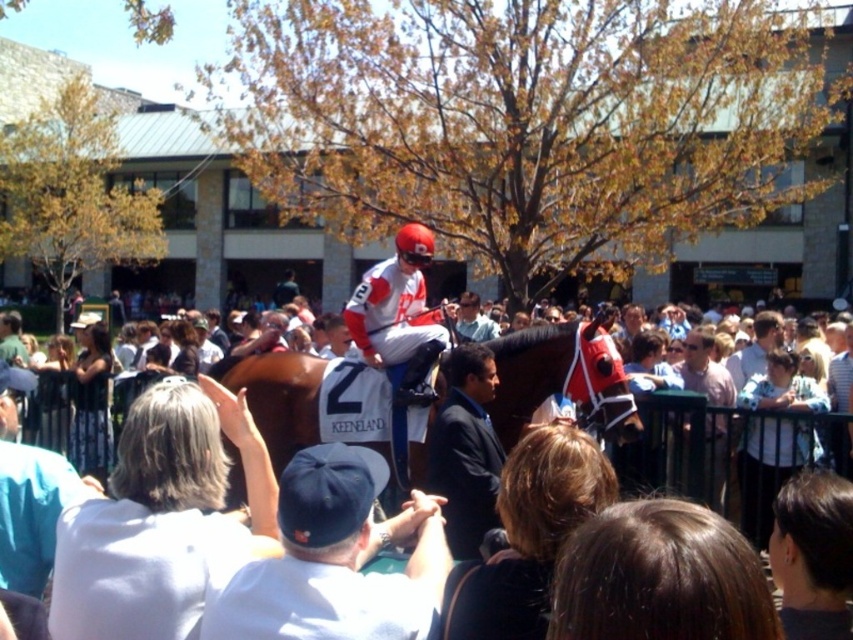
Question: Is matte red helmet at center wider than light blue shirt at center?

Choices:
 (A) yes
 (B) no

Answer: (A)

Question: Can you confirm if teal fabric shirt at lower left is positioned to the left of light pink shirt at center?

Choices:
 (A) no
 (B) yes

Answer: (B)

Question: Among these points, which one is farthest from the camera?

Choices:
 (A) (299, 364)
 (B) (1, 416)
 (C) (775, 336)
 (D) (490, 317)

Answer: (D)

Question: Does white cotton cap at center appear over teal fabric shirt at lower left?

Choices:
 (A) yes
 (B) no

Answer: (B)

Question: Estimate the real-world distances between objects in this image. Which object is closer to the white cotton cap at center?

Choices:
 (A) light pink shirt at center
 (B) matte red helmet at center
 (C) shiny brown horse at center

Answer: (C)

Question: Which of the following is the farthest from the observer?

Choices:
 (A) light blue shirt at center
 (B) light brown leather jacket at center
 (C) teal fabric shirt at lower left
 (D) light pink shirt at center

Answer: (B)